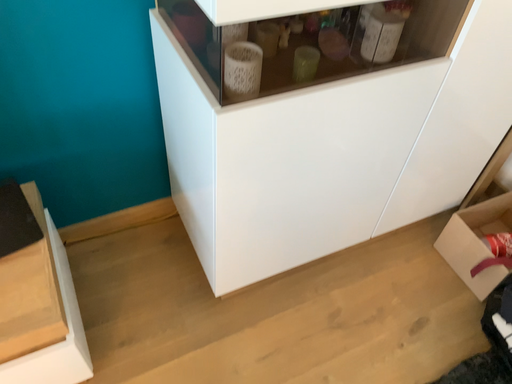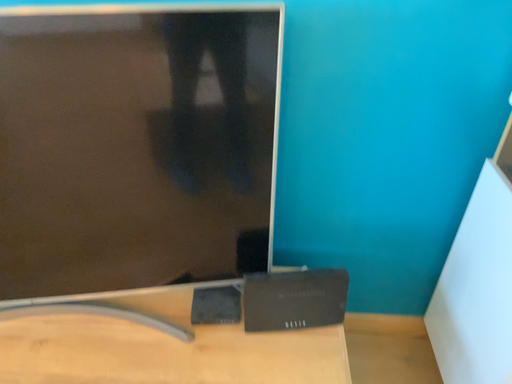
Question: Which way did the camera rotate in the video?

Choices:
 (A) rotated right
 (B) rotated left

Answer: (B)